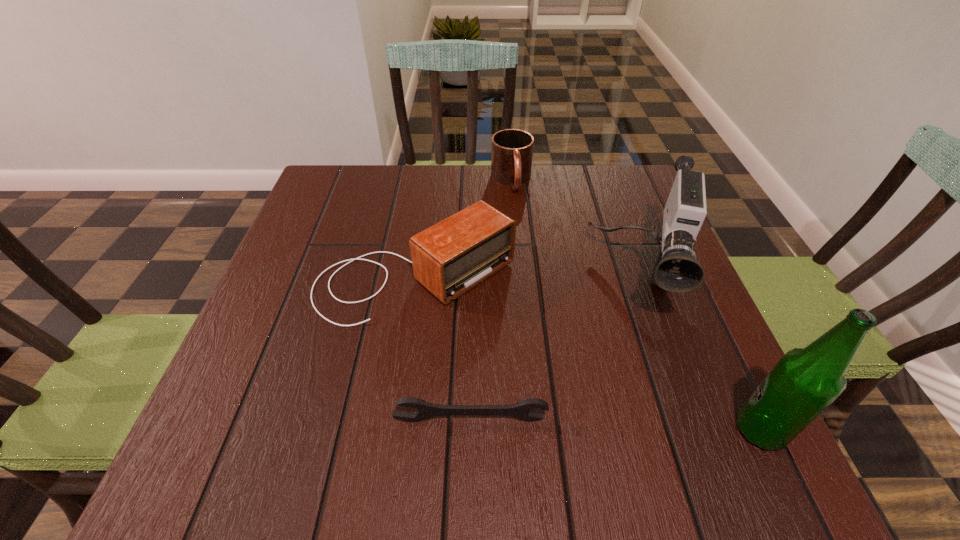
Where is `vacant space that is in between the second tallest object and the tallest object`? This screenshot has height=540, width=960. vacant space that is in between the second tallest object and the tallest object is located at coordinates (700, 356).

Where is `vacant point located between the camcorder and the tallest object`? This screenshot has width=960, height=540. vacant point located between the camcorder and the tallest object is located at coordinates pyautogui.click(x=700, y=356).

Where is `vacant area that lies between the farthest object and the wrench`? This screenshot has width=960, height=540. vacant area that lies between the farthest object and the wrench is located at coordinates (491, 300).

What are the coordinates of `empty space between the tallest object and the wrench` in the screenshot? It's located at (615, 425).

Locate an element on the screen. The width and height of the screenshot is (960, 540). free spot between the fourth shortest object and the shortest object is located at coordinates (555, 351).

I want to click on free point between the wrench and the camcorder, so click(555, 351).

Identify the location of vacant region between the radio receiver and the shortest object. pyautogui.click(x=443, y=350).

Locate which object is the closest to the radio receiver. Please provide its 2D coordinates. Your answer should be formatted as a tuple, i.e. [(x, y)], where the tuple contains the x and y coordinates of a point satisfying the conditions above.

[(676, 270)]

Locate an element on the screen. Image resolution: width=960 pixels, height=540 pixels. the fourth closest object to the radio receiver is located at coordinates (805, 381).

Find the location of a particular element. This screenshot has height=540, width=960. free space that satisfies the following two spatial constraints: 1. on the front side of the tallest object; 2. on the label of the farthest object is located at coordinates (534, 430).